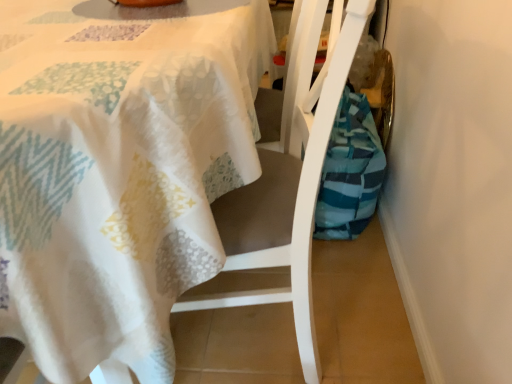
Image resolution: width=512 pixels, height=384 pixels. Identify the location of teal striped fabric bag at lower right. (350, 171).

I want to click on white fabric chair at center, so click(x=290, y=176).

Which is less distant, [265,195] or [153,88]?

The point [153,88] is closer.

Which object is positioned more to the right, white fabric chair at center or white textured tablecloth at upper left?

white fabric chair at center is more to the right.

Based on the photo, from a real-world perspective, which is physically below, white fabric chair at center or white textured tablecloth at upper left?

In real-world perspective, white textured tablecloth at upper left is lower.

Does white textured tablecloth at upper left turn towards white fabric chair at center?

Yes.

Find the location of a particular element. chair lying below the white textured tablecloth at upper left (from the image's perspective) is located at coordinates (290, 176).

Between white textured tablecloth at upper left and white fabric chair at center, which one is positioned behind?

white fabric chair at center is further away from the camera.

Who is smaller, white textured tablecloth at upper left or white fabric chair at center?

white fabric chair at center is smaller.

Does white fabric chair at center come behind teal striped fabric bag at lower right?

No, white fabric chair at center is closer to the camera.

Which is closer, (251, 231) or (358, 112)?

Point (251, 231) appears to be closer to the viewer than point (358, 112).

Is teal striped fabric bag at lower right at the back of white fabric chair at center?

No, white fabric chair at center is not facing the opposite direction of teal striped fabric bag at lower right.

From the image's perspective, would you say white fabric chair at center is positioned over teal striped fabric bag at lower right?

No, from the image's perspective, white fabric chair at center is not above teal striped fabric bag at lower right.

In the scene shown: Is white textured tablecloth at upper left with teal striped fabric bag at lower right?

There is a gap between white textured tablecloth at upper left and teal striped fabric bag at lower right.

Considering the relative positions of white textured tablecloth at upper left and teal striped fabric bag at lower right in the image provided, is white textured tablecloth at upper left behind teal striped fabric bag at lower right?

No.

Is point (6, 8) farther from camera compared to point (334, 126)?

No, (6, 8) is in front of (334, 126).

The height and width of the screenshot is (384, 512). I want to click on material that is under the white textured tablecloth at upper left (from a real-world perspective), so click(350, 171).

Are teal striped fabric bag at lower right and white fabric chair at center located far from each other?

That's not correct — teal striped fabric bag at lower right is a little close to white fabric chair at center.

From a real-world perspective, is teal striped fabric bag at lower right on top of white fabric chair at center?

Actually, teal striped fabric bag at lower right is physically below white fabric chair at center in the real world.

From the picture: Is teal striped fabric bag at lower right oriented away from white fabric chair at center?

That's not correct — teal striped fabric bag at lower right is not looking away from white fabric chair at center.

How different are the orientations of teal striped fabric bag at lower right and white fabric chair at center in degrees?

There is a 90-degree angle between the facing directions of teal striped fabric bag at lower right and white fabric chair at center.

Which object is thinner, teal striped fabric bag at lower right or white textured tablecloth at upper left?

teal striped fabric bag at lower right.

Is teal striped fabric bag at lower right bigger than white textured tablecloth at upper left?

Actually, teal striped fabric bag at lower right might be smaller than white textured tablecloth at upper left.

This screenshot has width=512, height=384. What are the coordinates of `tablecloth in front of the teal striped fabric bag at lower right` in the screenshot? It's located at (119, 170).

I want to click on chair above the white textured tablecloth at upper left (from a real-world perspective), so click(290, 176).

Where is `chair that appears below the white textured tablecloth at upper left (from the image's perspective)`? The image size is (512, 384). chair that appears below the white textured tablecloth at upper left (from the image's perspective) is located at coordinates (290, 176).

Estimate the real-world distances between objects in this image. Which object is further from white textured tablecloth at upper left, teal striped fabric bag at lower right or white fabric chair at center?

teal striped fabric bag at lower right is further to white textured tablecloth at upper left.

Considering their positions, is white fabric chair at center positioned closer to teal striped fabric bag at lower right than white textured tablecloth at upper left?

white fabric chair at center is positioned closer to the anchor teal striped fabric bag at lower right.

When comparing their distances from white fabric chair at center, does white textured tablecloth at upper left or teal striped fabric bag at lower right seem closer?

white textured tablecloth at upper left is positioned closer to the anchor white fabric chair at center.

Estimate the real-world distances between objects in this image. Which object is further from teal striped fabric bag at lower right, white textured tablecloth at upper left or white fabric chair at center?

white textured tablecloth at upper left.

Estimate the real-world distances between objects in this image. Which object is further from white fabric chair at center, teal striped fabric bag at lower right or white textured tablecloth at upper left?

Among the two, teal striped fabric bag at lower right is located further to white fabric chair at center.

When comparing their distances from white textured tablecloth at upper left, does white fabric chair at center or teal striped fabric bag at lower right seem closer?

white fabric chair at center is positioned closer to the anchor white textured tablecloth at upper left.

Locate an element on the screen. chair located between white textured tablecloth at upper left and teal striped fabric bag at lower right in the depth direction is located at coordinates (290, 176).